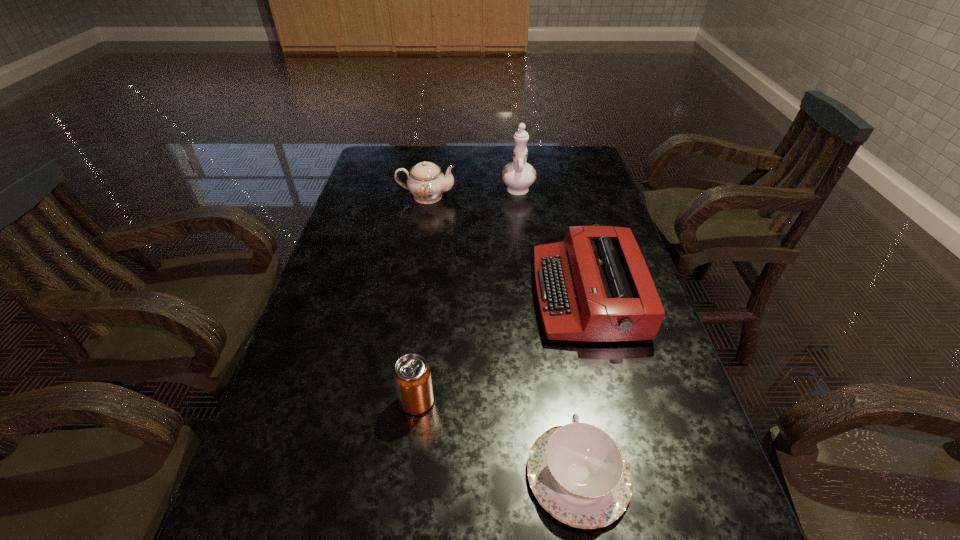
Find the location of a particular element. Image resolution: width=960 pixels, height=540 pixels. the tallest chinaware is located at coordinates (518, 175).

Image resolution: width=960 pixels, height=540 pixels. In order to click on the leftmost chinaware in this screenshot , I will do `click(426, 182)`.

What are the coordinates of `soda can` in the screenshot? It's located at (412, 375).

Locate an element on the screen. Image resolution: width=960 pixels, height=540 pixels. the fourth nearest object is located at coordinates (595, 286).

Identify the location of the fifth farthest object. (578, 474).

The height and width of the screenshot is (540, 960). In order to click on the nearest chinaware in this screenshot , I will do `click(578, 474)`.

The image size is (960, 540). What are the coordinates of `vacant space positioned 0.050m at the spout of the tallest object` in the screenshot? It's located at (516, 169).

I want to click on blank area located at the spout of the tallest object, so click(x=514, y=157).

You are a GUI agent. You are given a task and a screenshot of the screen. Output one action in this format:
    pyautogui.click(x=<x>, y=<y>)
    Task: Click on the free space located 0.210m at the spout of the tallest object
    Image resolution: width=960 pixels, height=540 pixels.
    Given the screenshot: What is the action you would take?
    pyautogui.click(x=513, y=148)

Identify the location of free point located at the spout of the leftmost chinaware. Image resolution: width=960 pixels, height=540 pixels. (558, 197).